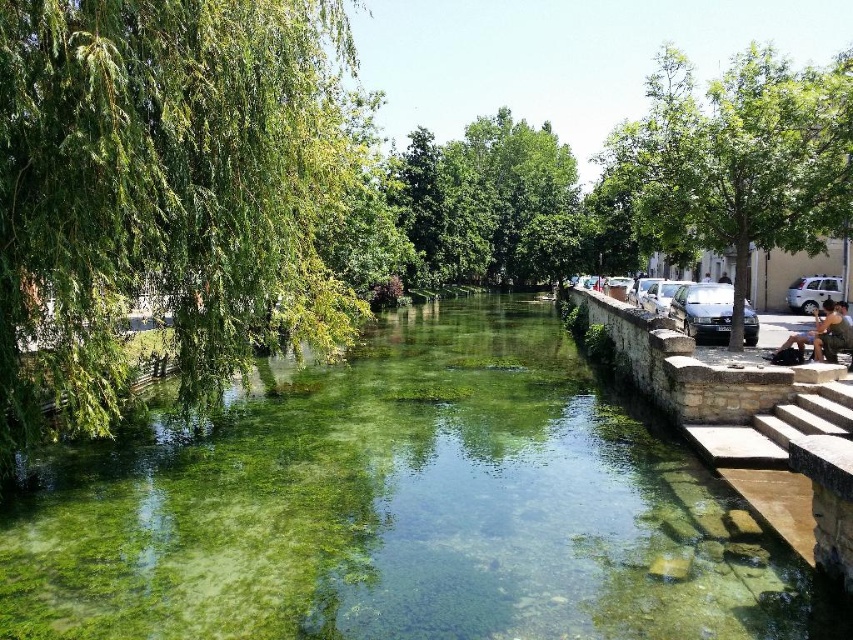
Which is below, green leafy tree at left or green leafy tree at center?

green leafy tree at left is lower down.

Does green leafy tree at left have a smaller size compared to green leafy tree at center?

Yes, green leafy tree at left is smaller than green leafy tree at center.

Does point (86, 292) lie behind point (543, 202)?

No.

The width and height of the screenshot is (853, 640). What are the coordinates of `green leafy tree at left` in the screenshot? It's located at (163, 193).

Based on the photo, is green leafy tree at left above camouflage fabric person at right?

Correct, green leafy tree at left is located above camouflage fabric person at right.

Which is above, green leafy tree at left or camouflage fabric person at right?

green leafy tree at left

Identify the location of green leafy tree at left. (163, 193).

Which is behind, point (534, 138) or point (790, 426)?

The point (534, 138) is behind.

Is point (552, 237) in front of point (753, 454)?

No, it is not.

Does point (498, 192) lie behind point (735, 451)?

That is True.

Locate an element on the screen. green leafy tree at center is located at coordinates (486, 202).